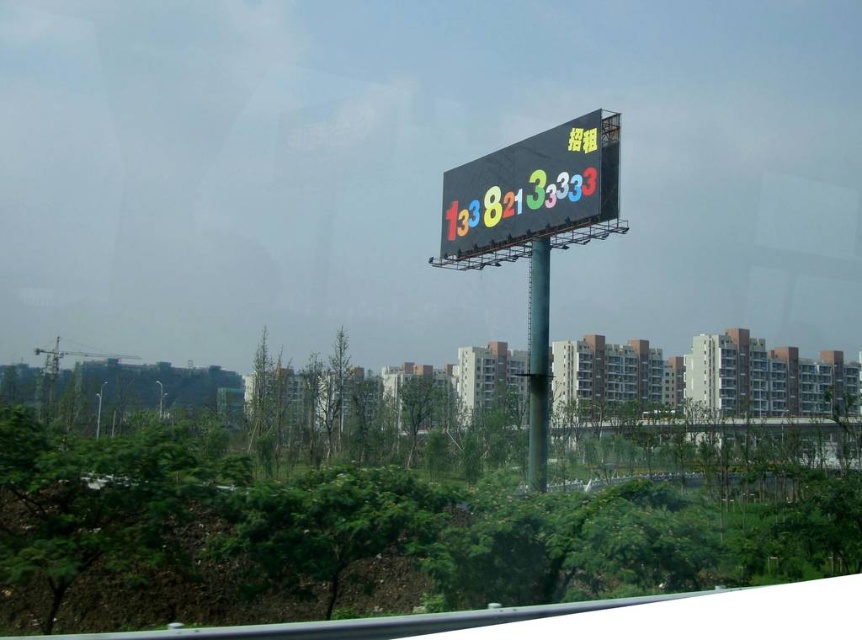
Which of these two, multicolored digital display at center or green metallic pole at center, stands shorter?

Standing shorter between the two is multicolored digital display at center.

Where is `multicolored digital display at center`? multicolored digital display at center is located at coordinates (533, 193).

Is point (519, 161) positioned after point (540, 244)?

Yes, it is behind point (540, 244).

What are the coordinates of `multicolored digital display at center` in the screenshot? It's located at (x=533, y=193).